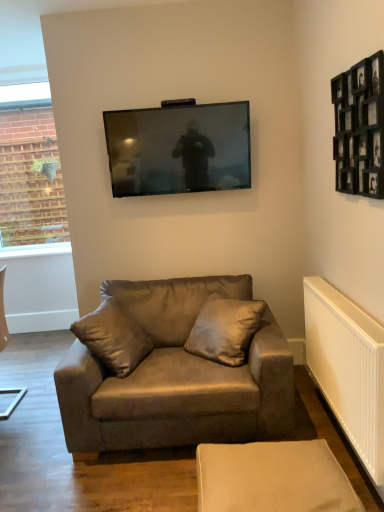
Question: Is white plastic radiator at lower right spatially inside matte black tv at upper center, or outside of it?

Choices:
 (A) inside
 (B) outside

Answer: (B)

Question: From a real-world perspective, is white plastic radiator at lower right above or below matte black tv at upper center?

Choices:
 (A) above
 (B) below

Answer: (B)

Question: Based on their relative distances, which object is farther from the suede-like beige pillow at center?

Choices:
 (A) suede brown couch at center
 (B) black wooden picture frame at upper right
 (C) white plastic radiator at lower right
 (D) beige fabric ottoman at lower center
 (E) matte black tv at upper center

Answer: (B)

Question: Which object is the farthest from the suede brown couch at center?

Choices:
 (A) white plastic radiator at lower right
 (B) beige fabric ottoman at lower center
 (C) suede-like beige pillow at center
 (D) matte black tv at upper center
 (E) black wooden picture frame at upper right

Answer: (E)